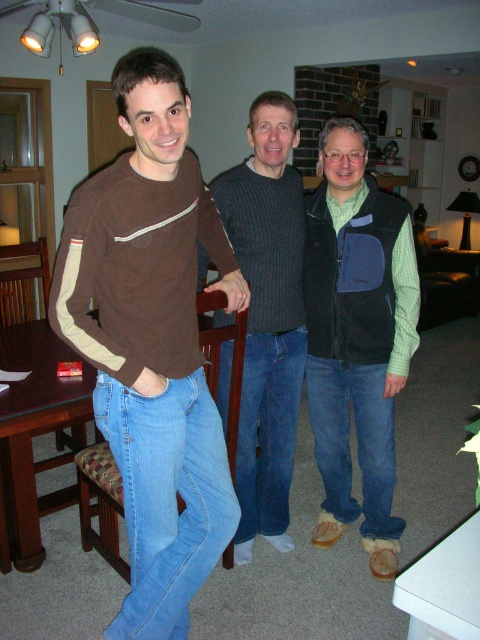
Does brown cotton shirt at center have a greater width compared to green textured vest at center?

Indeed, brown cotton shirt at center has a greater width compared to green textured vest at center.

Locate an element on the screen. brown cotton shirt at center is located at coordinates (152, 342).

Who is more distant from viewer, (156,515) or (59,403)?

The point (59,403) is more distant.

In the scene shown: Is brown cotton shirt at center wider than brown wooden dining table at center?

In fact, brown cotton shirt at center might be narrower than brown wooden dining table at center.

Locate an element on the screen. brown cotton shirt at center is located at coordinates (152, 342).

Is dark gray ribbed sweater at center smaller than brown wooden dining table at center?

Correct, dark gray ribbed sweater at center occupies less space than brown wooden dining table at center.

Who is taller, dark gray ribbed sweater at center or brown wooden dining table at center?

Standing taller between the two is dark gray ribbed sweater at center.

Who is more distant from viewer, (252, 412) or (35, 392)?

The point (252, 412) is behind.

Identify the location of dark gray ribbed sweater at center. (266, 316).